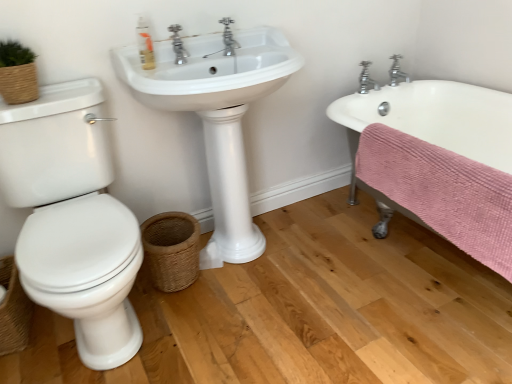
Image resolution: width=512 pixels, height=384 pixels. I want to click on free space in front of woven brown basket at lower center, acting as the 1th basket starting from the right, so click(x=179, y=325).